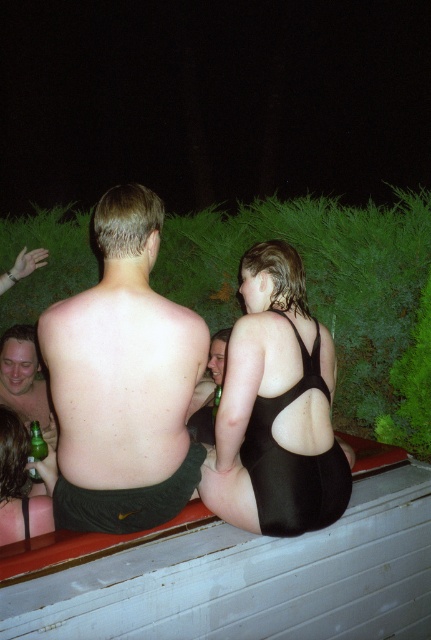
Question: Is shiny metallic beer bottle at lower left thinner than green glass bottle at lower left?

Choices:
 (A) yes
 (B) no

Answer: (B)

Question: Which of the following is the closest to the observer?

Choices:
 (A) (30, 442)
 (B) (3, 467)
 (C) (134, 365)
 (D) (293, 490)

Answer: (C)

Question: Which point is closer to the camera?

Choices:
 (A) shiny metallic beer bottle at lower left
 (B) green glass bottle at lower left
 (C) black matte swimsuit at center
 (D) white painted wood at lower center

Answer: (D)

Question: Is white painted wood at lower center wider than black matte swimsuit at center?

Choices:
 (A) no
 (B) yes

Answer: (B)

Question: Considering the real-world distances, which object is farthest from the white painted wood at lower center?

Choices:
 (A) skinny white man at center
 (B) black matte bikini top at center
 (C) shiny metallic beer bottle at lower left
 (D) black matte swimsuit at center

Answer: (C)

Question: Does black matte bikini top at center appear under black matte swimsuit at center?

Choices:
 (A) yes
 (B) no

Answer: (B)